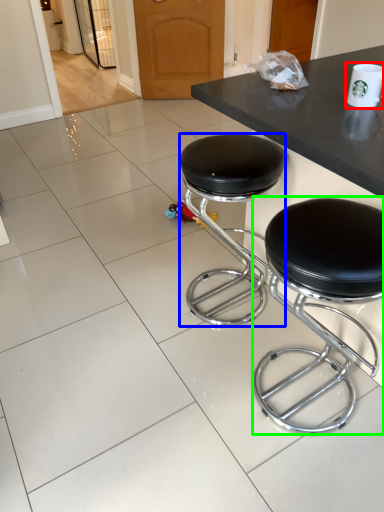
Question: Considering the real-world distances, which object is closest to paper cup (highlighted by a red box)? stool (highlighted by a blue box) or stool (highlighted by a green box).

Choices:
 (A) stool
 (B) stool

Answer: (B)